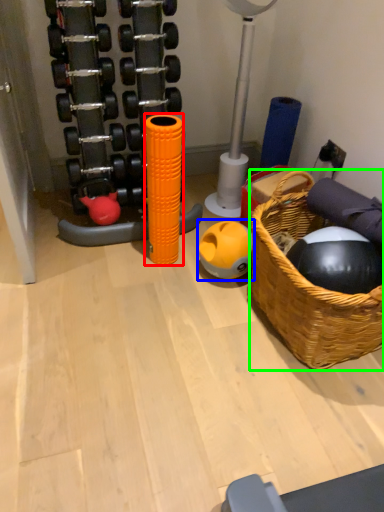
Question: Which is farther away from toy (highlighted by a red box)? ball (highlighted by a blue box) or basket (highlighted by a green box)?

Choices:
 (A) ball
 (B) basket

Answer: (B)